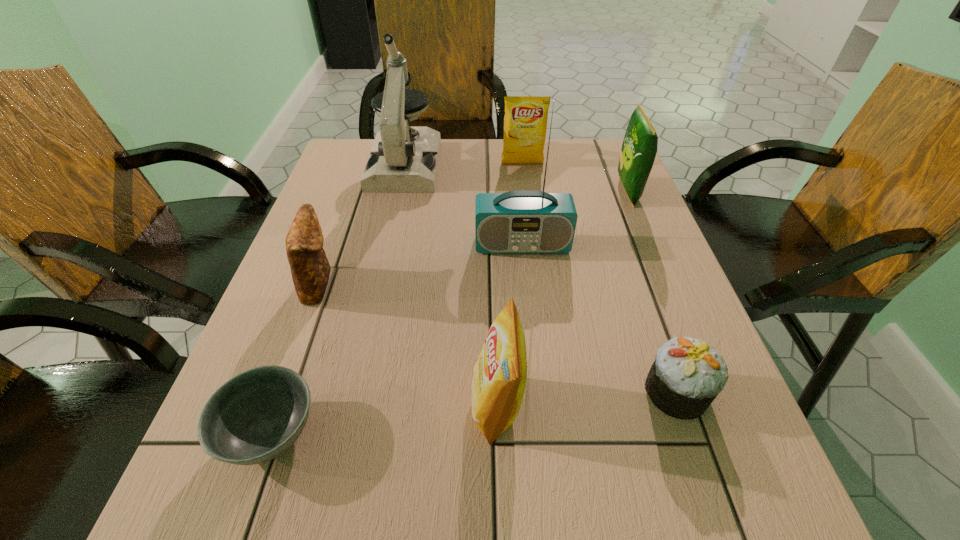
Where is `object that is at the far right corner`? object that is at the far right corner is located at coordinates (639, 148).

This screenshot has height=540, width=960. What are the coordinates of `vacant region at the far edge of the desktop` in the screenshot? It's located at (484, 154).

This screenshot has height=540, width=960. I want to click on vacant region at the near edge of the desktop, so click(520, 482).

The width and height of the screenshot is (960, 540). In the image, there is a desktop. Find the location of `free space at the left edge`. free space at the left edge is located at coordinates (347, 260).

You are a GUI agent. You are given a task and a screenshot of the screen. Output one action in this format:
    pyautogui.click(x=<x>, y=<y>)
    Task: Click on the vacant area at the right edge of the desktop
    
    Given the screenshot: What is the action you would take?
    pyautogui.click(x=590, y=221)

Locate an element on the screen. vacant space at the near left corner of the desktop is located at coordinates (257, 530).

In the image, there is a desktop. Identify the location of blank space at the near right corner. (732, 514).

Where is `free space that is in between the farthest crisp (potato chip) and the nearest crisp (potato chip)`? This screenshot has height=540, width=960. free space that is in between the farthest crisp (potato chip) and the nearest crisp (potato chip) is located at coordinates (510, 285).

Where is `empty space between the nearest crisp (potato chip) and the sixth tallest object`? The height and width of the screenshot is (540, 960). empty space between the nearest crisp (potato chip) and the sixth tallest object is located at coordinates (408, 344).

Image resolution: width=960 pixels, height=540 pixels. In order to click on free space between the microscope and the rightmost crisp (potato chip) in this screenshot , I will do `click(516, 178)`.